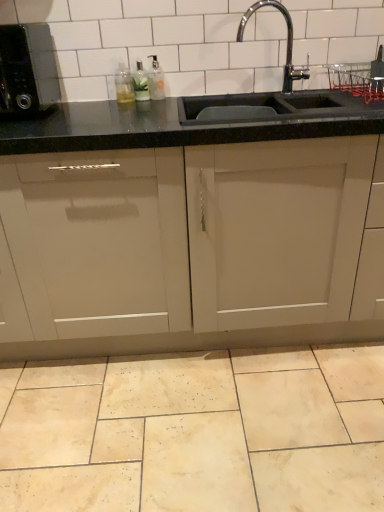
Identify the location of free point above beige marble tile at lower center (from a real-world perspective). (191, 406).